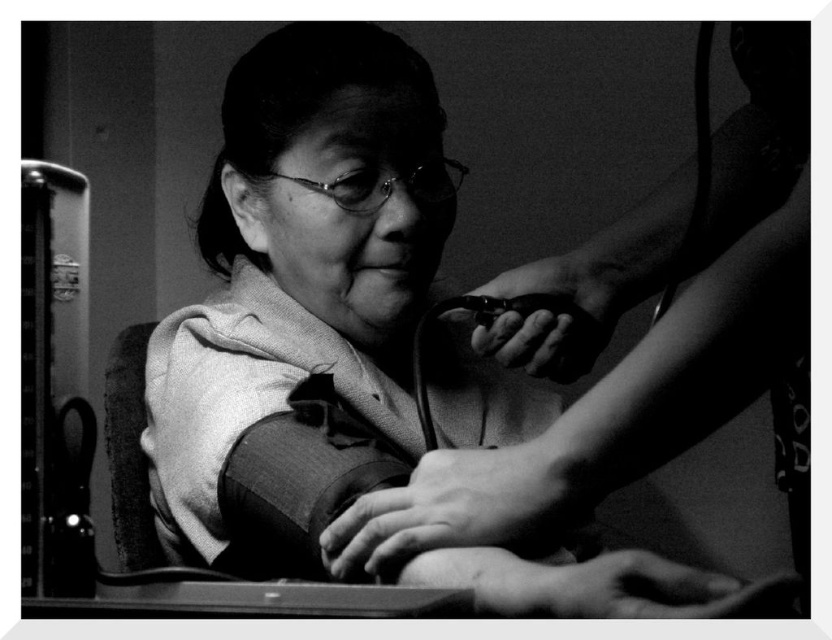
Question: Among these points, which one is nearest to the camera?

Choices:
 (A) (214, 225)
 (B) (602, 413)

Answer: (B)

Question: Is smooth plastic comb at upper center wider than black matte hair at upper center?

Choices:
 (A) yes
 (B) no

Answer: (A)

Question: Is smooth plastic comb at upper center smaller than black matte hair at upper center?

Choices:
 (A) no
 (B) yes

Answer: (A)

Question: Does smooth plastic comb at upper center appear under black matte hair at upper center?

Choices:
 (A) yes
 (B) no

Answer: (A)

Question: Which of the following is the closest to the observer?

Choices:
 (A) (741, 67)
 (B) (238, 246)

Answer: (A)